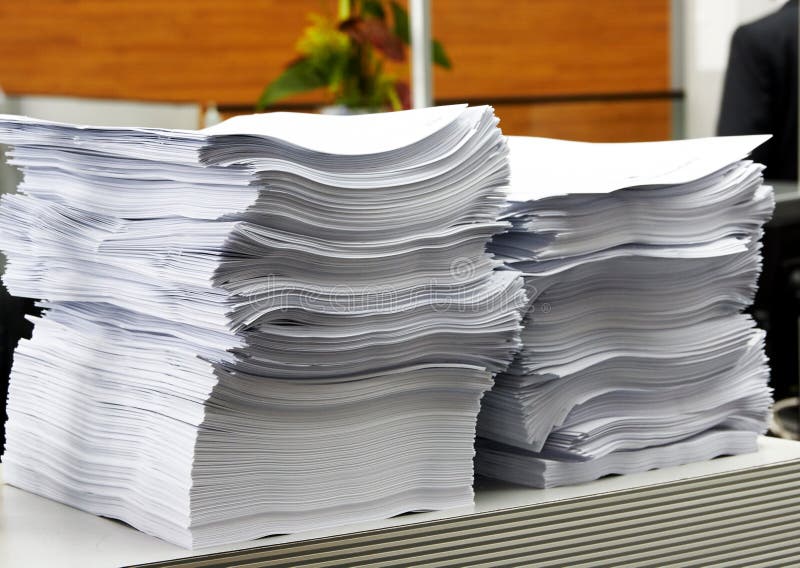
I want to click on table top, so click(512, 501).